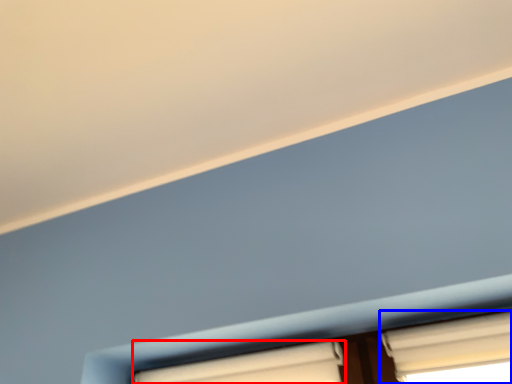
Question: Which point is further to the camera, window (highlighted by a red box) or window (highlighted by a blue box)?

Choices:
 (A) window
 (B) window

Answer: (A)